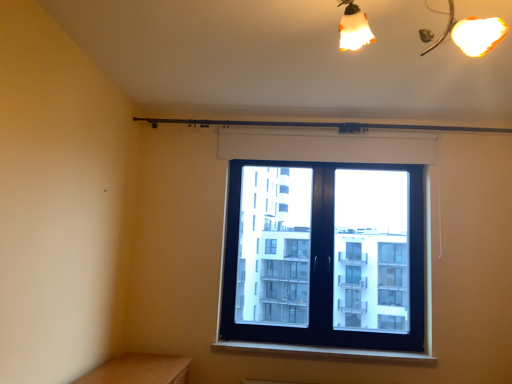
Question: From the image's perspective, would you say white plastic window sill at lower center is positioned over white matte shutter at upper center?

Choices:
 (A) no
 (B) yes

Answer: (A)

Question: From a real-world perspective, is white plastic window sill at lower center positioned under white matte shutter at upper center based on gravity?

Choices:
 (A) yes
 (B) no

Answer: (A)

Question: Does white plastic window sill at lower center have a lesser height compared to white matte shutter at upper center?

Choices:
 (A) no
 (B) yes

Answer: (B)

Question: Considering the relative sizes of white plastic window sill at lower center and white matte shutter at upper center in the image provided, is white plastic window sill at lower center bigger than white matte shutter at upper center?

Choices:
 (A) yes
 (B) no

Answer: (A)

Question: Considering the relative positions of white plastic window sill at lower center and white matte shutter at upper center in the image provided, is white plastic window sill at lower center to the left of white matte shutter at upper center from the viewer's perspective?

Choices:
 (A) no
 (B) yes

Answer: (B)

Question: Is white plastic window sill at lower center smaller than white matte shutter at upper center?

Choices:
 (A) no
 (B) yes

Answer: (A)

Question: Could you tell me if black plastic window at center is facing white plastic window sill at lower center?

Choices:
 (A) no
 (B) yes

Answer: (A)

Question: Are black plastic window at center and white plastic window sill at lower center making contact?

Choices:
 (A) yes
 (B) no

Answer: (B)

Question: Considering the relative sizes of black plastic window at center and white plastic window sill at lower center in the image provided, is black plastic window at center shorter than white plastic window sill at lower center?

Choices:
 (A) yes
 (B) no

Answer: (B)

Question: From a real-world perspective, does black plastic window at center stand above white plastic window sill at lower center?

Choices:
 (A) yes
 (B) no

Answer: (A)

Question: From the image's perspective, is black plastic window at center below white plastic window sill at lower center?

Choices:
 (A) no
 (B) yes

Answer: (A)

Question: Is black plastic window at center wider than white plastic window sill at lower center?

Choices:
 (A) yes
 (B) no

Answer: (B)

Question: Is white plastic window sill at lower center smaller than black plastic window at center?

Choices:
 (A) yes
 (B) no

Answer: (A)